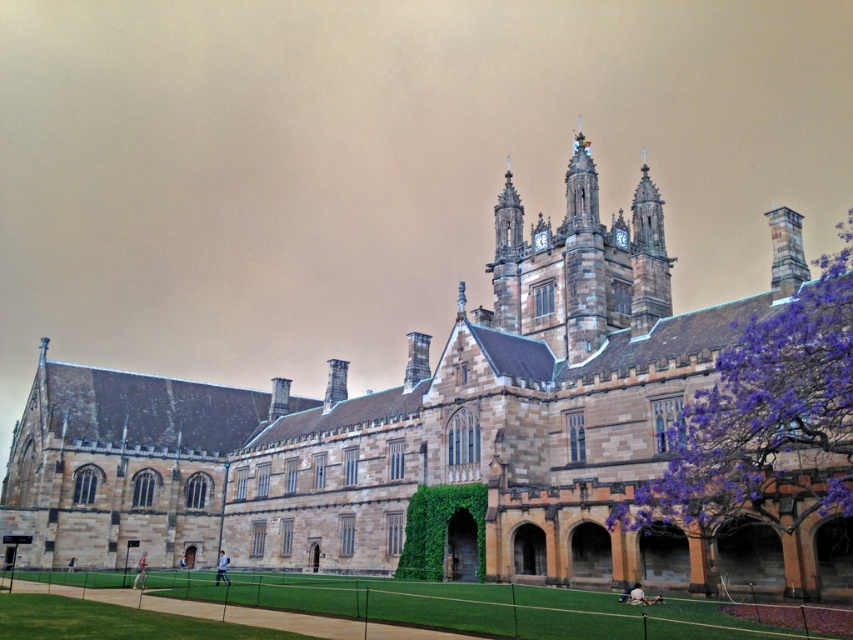
Question: Is purple wood tree at right wider than brown stone clock tower at upper center?

Choices:
 (A) no
 (B) yes

Answer: (B)

Question: Can you confirm if purple wood tree at right is bigger than brown stone clock tower at upper center?

Choices:
 (A) yes
 (B) no

Answer: (A)

Question: Does purple wood tree at right appear on the right side of brown stone clock tower at upper center?

Choices:
 (A) yes
 (B) no

Answer: (A)

Question: Which point appears farthest from the camera in this image?

Choices:
 (A) (590, 328)
 (B) (683, 486)

Answer: (A)

Question: Among these points, which one is nearest to the camera?

Choices:
 (A) (799, 413)
 (B) (556, 234)

Answer: (A)

Question: Which point is closer to the camera taking this photo?

Choices:
 (A) (640, 496)
 (B) (582, 275)

Answer: (A)